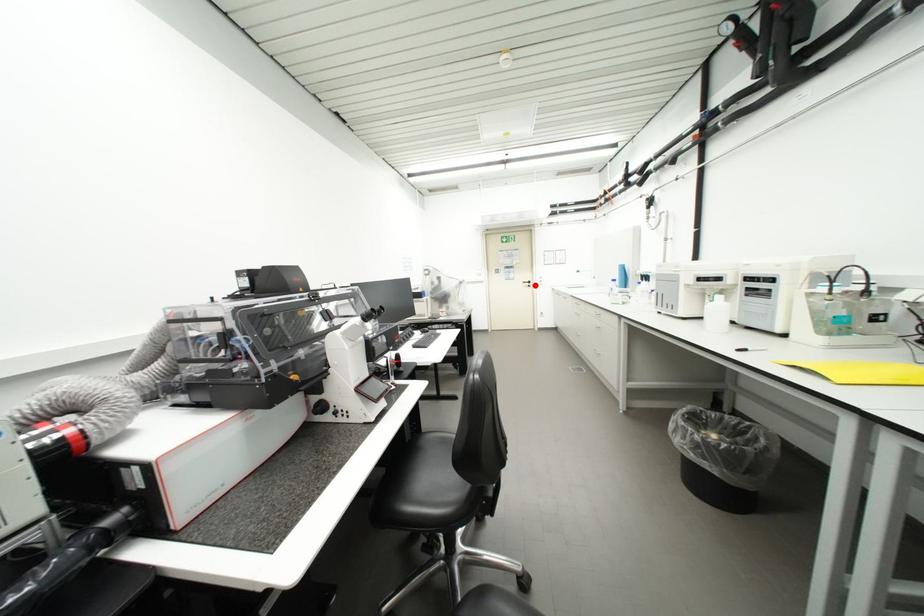
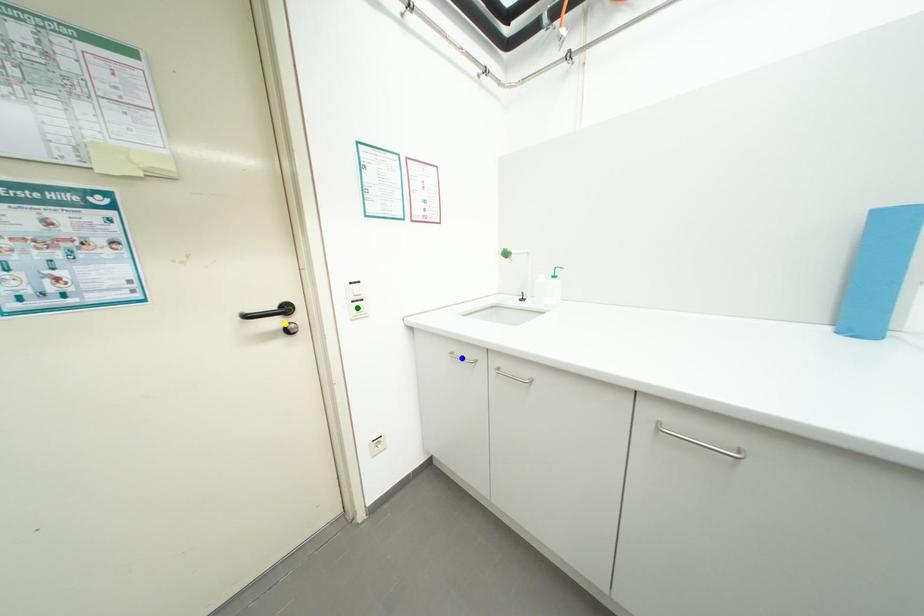
Question: I am providing you with two images of the same scene from different viewpoints. A red point is marked on the first image. You are given multiple points on the second image. Can you choose the point in image 2 that corresponds to the point in image 1?

Choices:
 (A) blue point
 (B) green point
 (C) yellow point

Answer: (C)